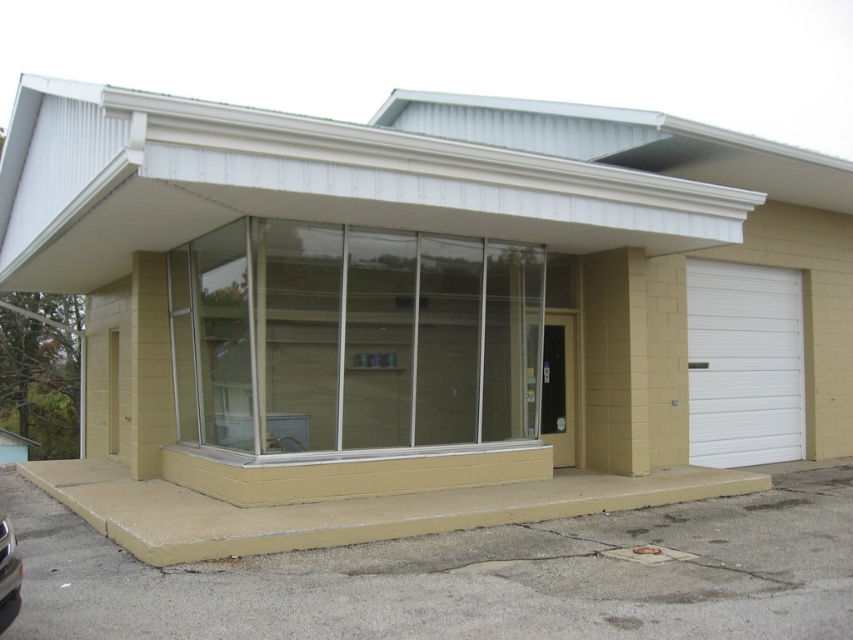
You are standing in front of the commercial building and want to locate the point at coordinates (744,364). Based on the description, can you identify which part of the building this point corresponds to?

The point at coordinates (744,364) is located on the white smooth garage door at right.

You are a delivery person trying to park your van in front of the commercial building. The van is too tall to fit under the overhang. Can you park closer to the shiny silver car at lower left without blocking the white smooth garage door at right?

The white smooth garage door at right is positioned over the shiny silver car at lower left, so parking closer to the shiny silver car at lower left would block the white smooth garage door at right. Therefore, you should park elsewhere to avoid blocking the garage door.